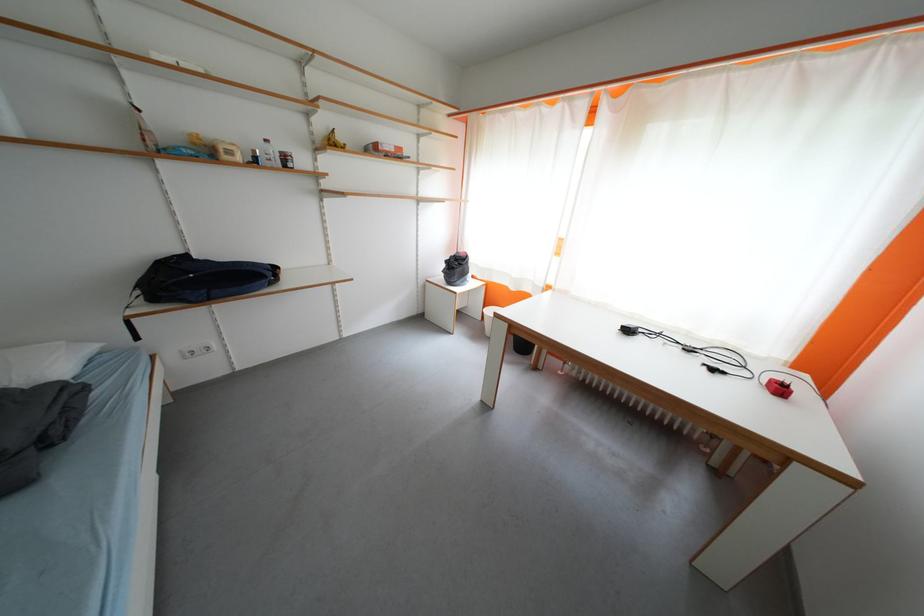
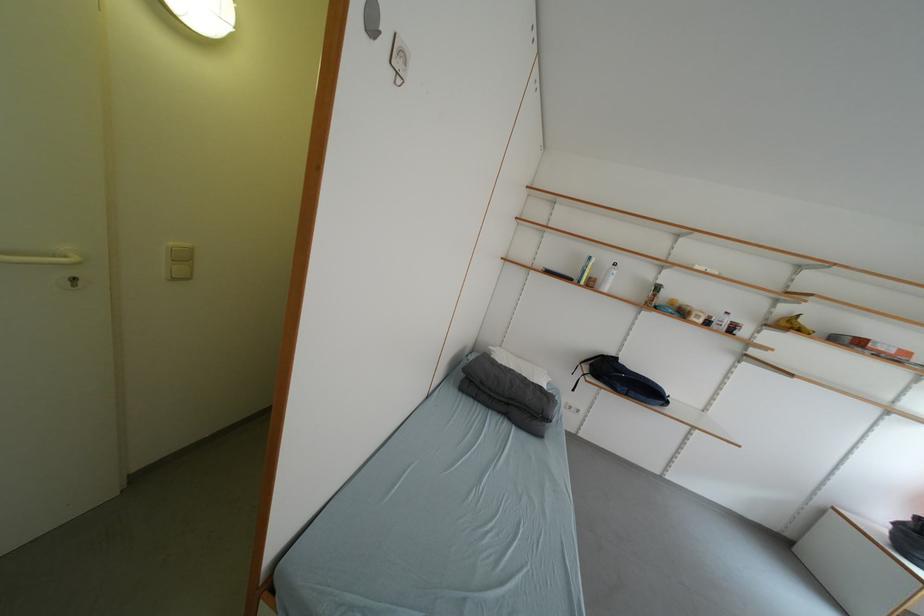
Question: The camera is either moving clockwise (left) or counter-clockwise (right) around the object. The first image is from the beginning of the video and the second image is from the end. Is the camera moving left or right when shooting the video?

Choices:
 (A) Left
 (B) Right

Answer: (B)